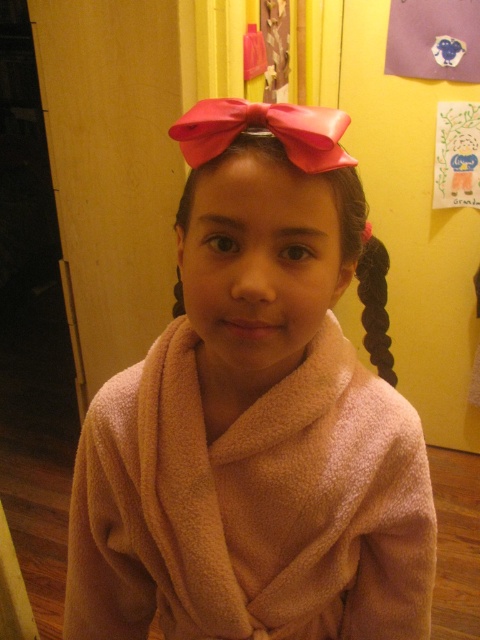
Measure the distance between pink fluffy robe at center and pink satin bow at center.

The distance of pink fluffy robe at center from pink satin bow at center is 8.67 inches.

Looking at this image, does pink fluffy robe at center appear over pink satin bow at center?

No, pink fluffy robe at center is not above pink satin bow at center.

Between point (414, 445) and point (184, 192), which one is positioned in front?

Positioned in front is point (184, 192).

Where is `pink fluffy robe at center`? Image resolution: width=480 pixels, height=640 pixels. pink fluffy robe at center is located at coordinates (254, 419).

Does pink satin bow at center appear on the right side of black silky hair at right?

In fact, pink satin bow at center is to the left of black silky hair at right.

Which of these two, pink satin bow at center or black silky hair at right, stands shorter?

pink satin bow at center

Does point (354, 221) come closer to viewer compared to point (370, 308)?

That is True.

I want to click on pink satin bow at center, so click(348, 211).

Can you confirm if pink fluffy robe at center is taller than black silky hair at right?

Indeed, pink fluffy robe at center has a greater height compared to black silky hair at right.

Which is below, pink fluffy robe at center or black silky hair at right?

Result: pink fluffy robe at center

Which is in front, point (323, 472) or point (370, 360)?

Point (323, 472) is more forward.

Find the location of a particular element. This screenshot has width=480, height=640. pink fluffy robe at center is located at coordinates (254, 419).